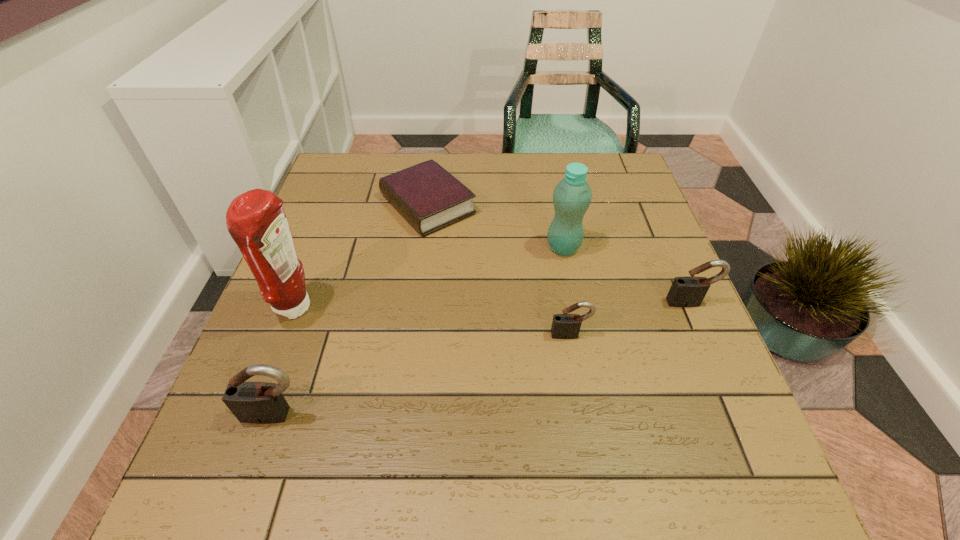
Locate an element on the screen. Image resolution: width=960 pixels, height=540 pixels. condiment at the left edge is located at coordinates [256, 220].

Identify the location of object that is at the right edge. The image size is (960, 540). (689, 291).

Identify the location of object that is at the near left corner. The width and height of the screenshot is (960, 540). (251, 402).

This screenshot has height=540, width=960. I want to click on free location at the far edge of the desktop, so click(459, 154).

In the image, there is a desktop. Identify the location of vacant space at the near edge. (634, 410).

In the image, there is a desktop. Where is `vacant space at the left edge`? This screenshot has width=960, height=540. vacant space at the left edge is located at coordinates (327, 240).

Find the location of `free space at the right edge of the desktop`. free space at the right edge of the desktop is located at coordinates (654, 245).

Locate an element on the screen. vacant space at the near left corner of the desktop is located at coordinates (302, 425).

The image size is (960, 540). I want to click on vacant region at the far right corner, so click(602, 188).

Image resolution: width=960 pixels, height=540 pixels. I want to click on free location at the near right corner, so click(x=708, y=396).